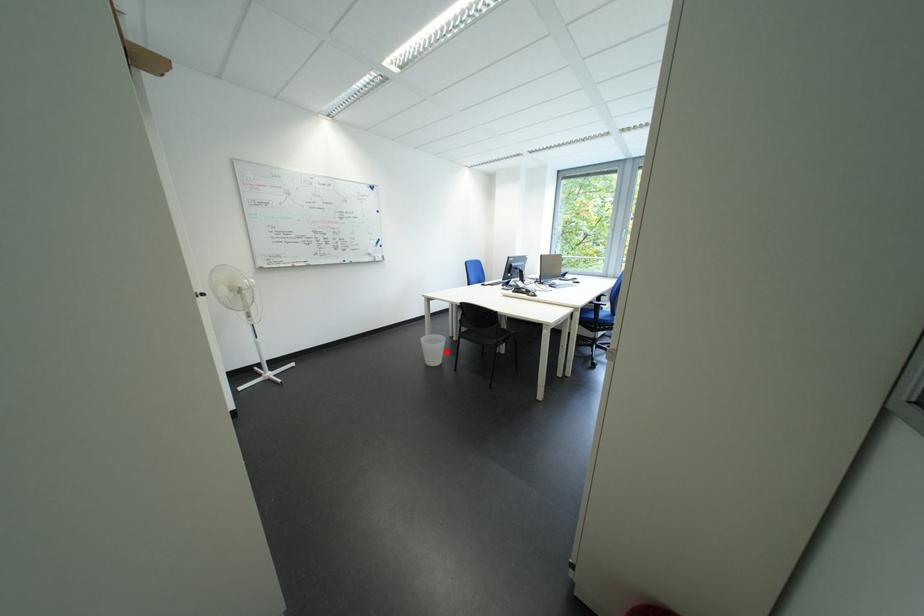
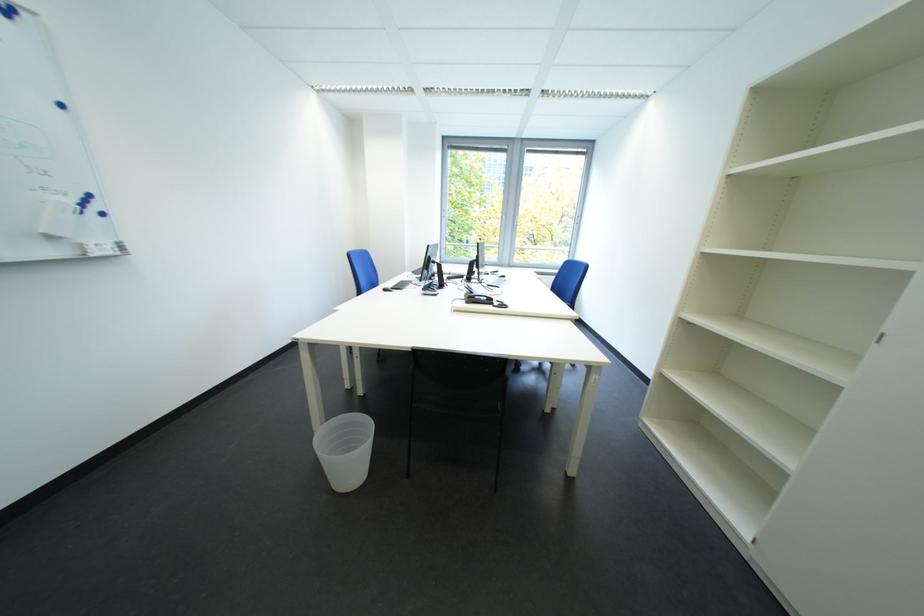
Question: I am providing you with two images of the same scene from different viewpoints. Image1 has a red point marked. In image2, the corresponding 3D location appears at what relative position? Reply with the corresponding letter.

Choices:
 (A) Closer
 (B) Farther

Answer: (B)